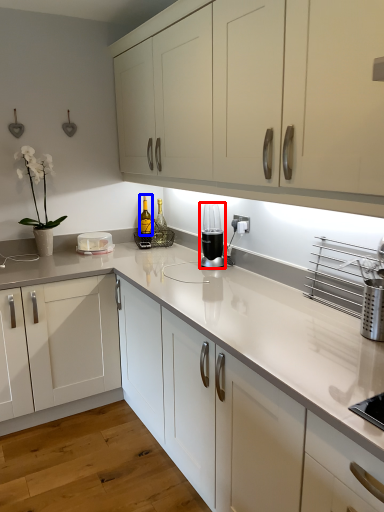
Question: Among these objects, which one is farthest to the camera, home appliance (highlighted by a red box) or bottle (highlighted by a blue box)?

Choices:
 (A) home appliance
 (B) bottle

Answer: (B)